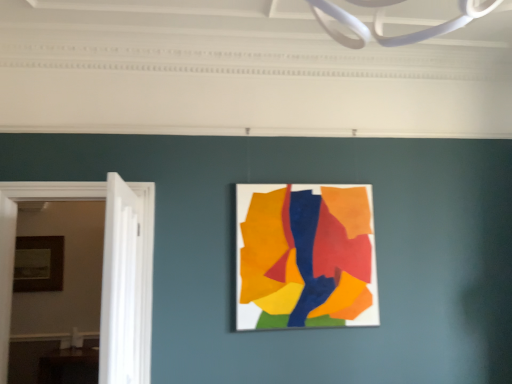
You are a GUI agent. You are given a task and a screenshot of the screen. Output one action in this format:
    pyautogui.click(x=<x>, y=<y>)
    Task: Click on the matte paper collage at center, which is the first picture frame from front to back
    This screenshot has height=384, width=512.
    Given the screenshot: What is the action you would take?
    pyautogui.click(x=305, y=256)

The image size is (512, 384). Identify the location of wooden picture frame at left, arranged as the 1th picture frame when viewed from the back. (38, 263).

Is wooden picture frame at left, arranged as the 1th picture frame when viewed from the back, smaller than matte paper collage at center, marked as the 1th picture frame in a right-to-left arrangement?

Yes, wooden picture frame at left, arranged as the 1th picture frame when viewed from the back, is smaller than matte paper collage at center, marked as the 1th picture frame in a right-to-left arrangement.

Is wooden picture frame at left, arranged as the 1th picture frame when viewed from the back, far from matte paper collage at center, marked as the 1th picture frame in a right-to-left arrangement?

Yes.

Is wooden picture frame at left, arranged as the 1th picture frame when viewed from the back, at the left side of matte paper collage at center, which is the 2th picture frame in left-to-right order?

Indeed, wooden picture frame at left, arranged as the 1th picture frame when viewed from the back, is positioned on the left side of matte paper collage at center, which is the 2th picture frame in left-to-right order.

From a real-world perspective, is wooden picture frame at left, placed as the 1th picture frame when sorted from left to right, positioned over matte paper collage at center, which is the first picture frame from front to back, based on gravity?

No.

Is white wooden door at left wider or thinner than wooden picture frame at left, arranged as the second picture frame when viewed from the right?

Considering their sizes, white wooden door at left looks broader than wooden picture frame at left, arranged as the second picture frame when viewed from the right.

Consider the image. From the image's perspective, is white wooden door at left located above wooden picture frame at left, arranged as the second picture frame when viewed from the right?

Yes.

Is there a large distance between white wooden door at left and wooden picture frame at left, arranged as the 1th picture frame when viewed from the back?

Indeed, white wooden door at left is not near wooden picture frame at left, arranged as the 1th picture frame when viewed from the back.

Which point is more forward, (297, 275) or (116, 254)?

The point (116, 254) is closer.

Looking at this image, does matte paper collage at center, which is the 2th picture frame in left-to-right order, have a smaller size compared to white wooden door at left?

Correct, matte paper collage at center, which is the 2th picture frame in left-to-right order, occupies less space than white wooden door at left.

This screenshot has width=512, height=384. What are the coordinates of `door that is under the matte paper collage at center, marked as the second picture frame in a back-to-front arrangement (from a real-world perspective)` in the screenshot? It's located at (121, 285).

Considering the sizes of objects matte paper collage at center, which is the first picture frame from front to back, and white wooden door at left in the image provided, who is wider, matte paper collage at center, which is the first picture frame from front to back, or white wooden door at left?

Wider between the two is white wooden door at left.

Locate an element on the screen. Image resolution: width=512 pixels, height=384 pixels. the 1st picture frame behind the white wooden door at left, counting from the anchor's position is located at coordinates (305, 256).

Is white wooden door at left closer to camera compared to matte paper collage at center, marked as the 1th picture frame in a right-to-left arrangement?

That is True.

From a real-world perspective, is white wooden door at left above or below matte paper collage at center, marked as the 1th picture frame in a right-to-left arrangement?

Clearly, from a real-world perspective, white wooden door at left is below matte paper collage at center, marked as the 1th picture frame in a right-to-left arrangement.

Which point is more forward, (122,355) or (257,193)?

Positioned in front is point (122,355).

Considering the sizes of objects matte paper collage at center, which is the 2th picture frame in left-to-right order, and wooden picture frame at left, placed as the 1th picture frame when sorted from left to right, in the image provided, who is shorter, matte paper collage at center, which is the 2th picture frame in left-to-right order, or wooden picture frame at left, placed as the 1th picture frame when sorted from left to right,?

With less height is wooden picture frame at left, placed as the 1th picture frame when sorted from left to right.

Does point (278, 224) appear closer or farther from the camera than point (32, 264)?

Point (278, 224) appears to be closer to the viewer than point (32, 264).

Which is more to the right, matte paper collage at center, marked as the 1th picture frame in a right-to-left arrangement, or wooden picture frame at left, which ranks as the second picture frame in front-to-back order?

From the viewer's perspective, matte paper collage at center, marked as the 1th picture frame in a right-to-left arrangement, appears more on the right side.

From the picture: Considering the sizes of matte paper collage at center, marked as the second picture frame in a back-to-front arrangement, and wooden picture frame at left, arranged as the second picture frame when viewed from the right, in the image, is matte paper collage at center, marked as the second picture frame in a back-to-front arrangement, bigger or smaller than wooden picture frame at left, arranged as the second picture frame when viewed from the right,?

Clearly, matte paper collage at center, marked as the second picture frame in a back-to-front arrangement, is larger in size than wooden picture frame at left, arranged as the second picture frame when viewed from the right.

From a real-world perspective, which object rests below the other?

white wooden door at left, from a real-world perspective.

Considering the sizes of wooden picture frame at left, placed as the 1th picture frame when sorted from left to right, and white wooden door at left in the image, is wooden picture frame at left, placed as the 1th picture frame when sorted from left to right, taller or shorter than white wooden door at left?

In the image, wooden picture frame at left, placed as the 1th picture frame when sorted from left to right, appears to be shorter than white wooden door at left.

From the picture: Would you say wooden picture frame at left, placed as the 1th picture frame when sorted from left to right, contains white wooden door at left?

Actually, white wooden door at left is outside wooden picture frame at left, placed as the 1th picture frame when sorted from left to right.

Are wooden picture frame at left, arranged as the 1th picture frame when viewed from the back, and white wooden door at left beside each other?

No.

Locate an element on the screen. picture frame that is on the left side of matte paper collage at center, marked as the 1th picture frame in a right-to-left arrangement is located at coordinates (38, 263).

In the image, there is a wooden picture frame at left, arranged as the 1th picture frame when viewed from the back. Identify the location of door below it (from a real-world perspective). (121, 285).

When comparing their distances from wooden picture frame at left, arranged as the second picture frame when viewed from the right, does white wooden door at left or matte paper collage at center, marked as the second picture frame in a back-to-front arrangement, seem closer?

The object closer to wooden picture frame at left, arranged as the second picture frame when viewed from the right, is white wooden door at left.

Based on their spatial positions, is white wooden door at left or wooden picture frame at left, arranged as the 1th picture frame when viewed from the back, further from matte paper collage at center, which is the first picture frame from front to back?

Among the two, wooden picture frame at left, arranged as the 1th picture frame when viewed from the back, is located further to matte paper collage at center, which is the first picture frame from front to back.

From the image, which object appears to be farther from white wooden door at left, matte paper collage at center, which is the first picture frame from front to back, or wooden picture frame at left, which ranks as the second picture frame in front-to-back order?

wooden picture frame at left, which ranks as the second picture frame in front-to-back order, is positioned further to the anchor white wooden door at left.

In the scene shown: Based on their spatial positions, is wooden picture frame at left, placed as the 1th picture frame when sorted from left to right, or matte paper collage at center, which is the first picture frame from front to back, closer to white wooden door at left?

The object closer to white wooden door at left is matte paper collage at center, which is the first picture frame from front to back.

Looking at the image, which one is located further to matte paper collage at center, which is the first picture frame from front to back, wooden picture frame at left, which ranks as the second picture frame in front-to-back order, or white wooden door at left?

Among the two, wooden picture frame at left, which ranks as the second picture frame in front-to-back order, is located further to matte paper collage at center, which is the first picture frame from front to back.

From the image, which object appears to be nearer to wooden picture frame at left, arranged as the 1th picture frame when viewed from the back, matte paper collage at center, which is the first picture frame from front to back, or white wooden door at left?

white wooden door at left.

The width and height of the screenshot is (512, 384). In order to click on door situated between wooden picture frame at left, which ranks as the second picture frame in front-to-back order, and matte paper collage at center, marked as the 1th picture frame in a right-to-left arrangement, from left to right in this screenshot , I will do `click(121, 285)`.